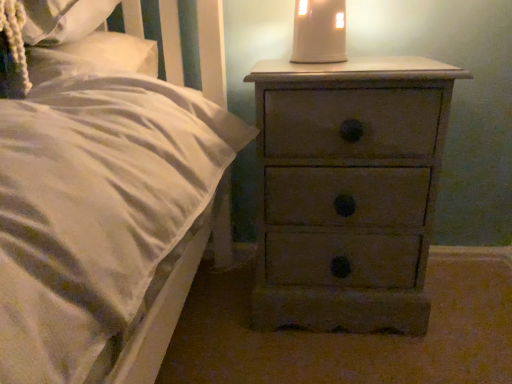
Question: From a real-world perspective, is distressed wood chest of drawers at right physically located above or below matte beige lampshade at upper center?

Choices:
 (A) above
 (B) below

Answer: (B)

Question: Is point (355, 180) closer or farther from the camera than point (323, 34)?

Choices:
 (A) closer
 (B) farther

Answer: (A)

Question: Based on their positions, is distressed wood chest of drawers at right located to the left or right of matte beige lampshade at upper center?

Choices:
 (A) right
 (B) left

Answer: (A)

Question: Is matte beige lampshade at upper center in front of or behind distressed wood chest of drawers at right in the image?

Choices:
 (A) front
 (B) behind

Answer: (B)

Question: Is matte beige lampshade at upper center to the left or to the right of distressed wood chest of drawers at right in the image?

Choices:
 (A) right
 (B) left

Answer: (B)

Question: In terms of size, does matte beige lampshade at upper center appear bigger or smaller than distressed wood chest of drawers at right?

Choices:
 (A) small
 (B) big

Answer: (A)

Question: Is point (313, 49) closer or farther from the camera than point (430, 69)?

Choices:
 (A) closer
 (B) farther

Answer: (B)